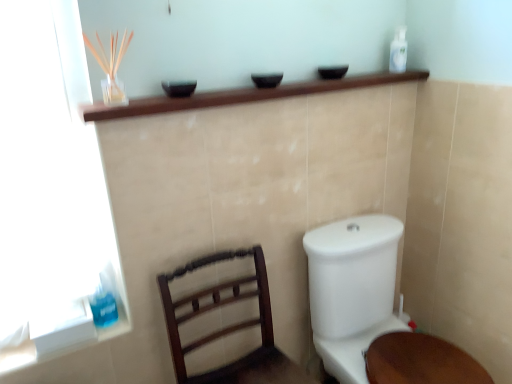
Question: Is dark wood chair at lower left wider than white plastic bottle at upper right, the 2th toiletry in the front-to-back sequence?

Choices:
 (A) yes
 (B) no

Answer: (A)

Question: Would you say white plastic bottle at upper right, the 1th toiletry viewed from the top, is part of dark wood chair at lower left's contents?

Choices:
 (A) yes
 (B) no

Answer: (B)

Question: Is dark wood chair at lower left shorter than white plastic bottle at upper right, the second toiletry ordered from the bottom?

Choices:
 (A) no
 (B) yes

Answer: (A)

Question: Considering the relative sizes of dark wood chair at lower left and white plastic bottle at upper right, the 1th toiletry viewed from the top, in the image provided, is dark wood chair at lower left thinner than white plastic bottle at upper right, the 1th toiletry viewed from the top,?

Choices:
 (A) yes
 (B) no

Answer: (B)

Question: From a real-world perspective, is dark wood chair at lower left physically above white plastic bottle at upper right, which appears as the 1th toiletry when viewed from the right?

Choices:
 (A) yes
 (B) no

Answer: (B)

Question: Would you say dark wood chair at lower left is to the left or to the right of white plastic bottle at upper right, which is the first toiletry from back to front, in the picture?

Choices:
 (A) right
 (B) left

Answer: (B)

Question: Is dark wood chair at lower left bigger or smaller than white plastic bottle at upper right, the 2th toiletry in the front-to-back sequence?

Choices:
 (A) big
 (B) small

Answer: (A)

Question: Is dark wood chair at lower left taller or shorter than white plastic bottle at upper right, the 2th toiletry in the front-to-back sequence?

Choices:
 (A) short
 (B) tall

Answer: (B)

Question: Choose the correct answer: Is dark wood chair at lower left inside white plastic bottle at upper right, the 1th toiletry viewed from the top, or outside it?

Choices:
 (A) inside
 (B) outside

Answer: (B)

Question: In terms of width, does white glossy toilet at lower right look wider or thinner when compared to white plastic bottle at upper right, which appears as the 1th toiletry when viewed from the right?

Choices:
 (A) thin
 (B) wide

Answer: (B)

Question: Is point (331, 332) closer or farther from the camera than point (398, 46)?

Choices:
 (A) farther
 (B) closer

Answer: (B)

Question: From the image's perspective, is white glossy toilet at lower right positioned above or below white plastic bottle at upper right, the second toiletry ordered from the bottom?

Choices:
 (A) above
 (B) below

Answer: (B)

Question: Considering the relative positions of white glossy toilet at lower right and white plastic bottle at upper right, the 2th toiletry in the front-to-back sequence, in the image provided, is white glossy toilet at lower right to the left or to the right of white plastic bottle at upper right, the 2th toiletry in the front-to-back sequence,?

Choices:
 (A) left
 (B) right

Answer: (A)

Question: Is point (98, 301) closer or farther from the camera than point (264, 316)?

Choices:
 (A) farther
 (B) closer

Answer: (B)

Question: From their relative heights in the image, would you say blue translucent liquid at lower left, the second toiletry viewed from the top, is taller or shorter than dark wood chair at lower left?

Choices:
 (A) tall
 (B) short

Answer: (B)